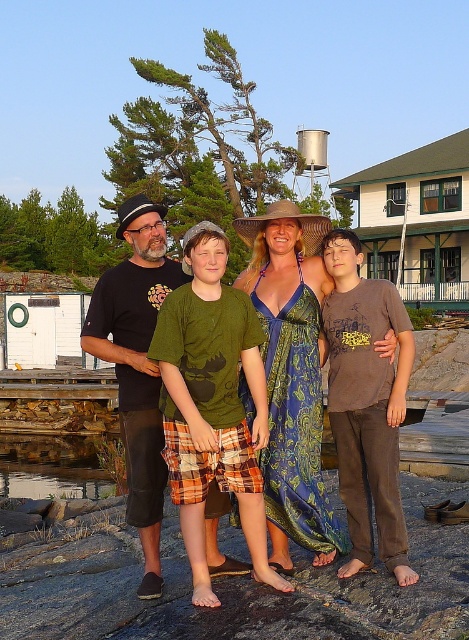
Question: Which object is closer to the camera taking this photo?

Choices:
 (A) black cotton t-shirt at left
 (B) green cotton shirt at center
 (C) brown cotton shirt at right
 (D) green cotton t-shirt at center

Answer: (B)

Question: Which of the following is the closest to the observer?

Choices:
 (A) [154, 385]
 (B) [134, 356]
 (C) [371, 305]
 (D) [234, 376]

Answer: (D)

Question: Does green cotton shirt at center appear on the left side of black cotton t-shirt at left?

Choices:
 (A) yes
 (B) no

Answer: (B)

Question: Is brown cotton shirt at right positioned behind black cotton t-shirt at left?

Choices:
 (A) yes
 (B) no

Answer: (A)

Question: Which of the following is the farthest from the observer?

Choices:
 (A) black cotton t-shirt at left
 (B) green cotton shirt at center

Answer: (A)

Question: Does green cotton t-shirt at center have a larger size compared to brown cotton shirt at right?

Choices:
 (A) no
 (B) yes

Answer: (A)